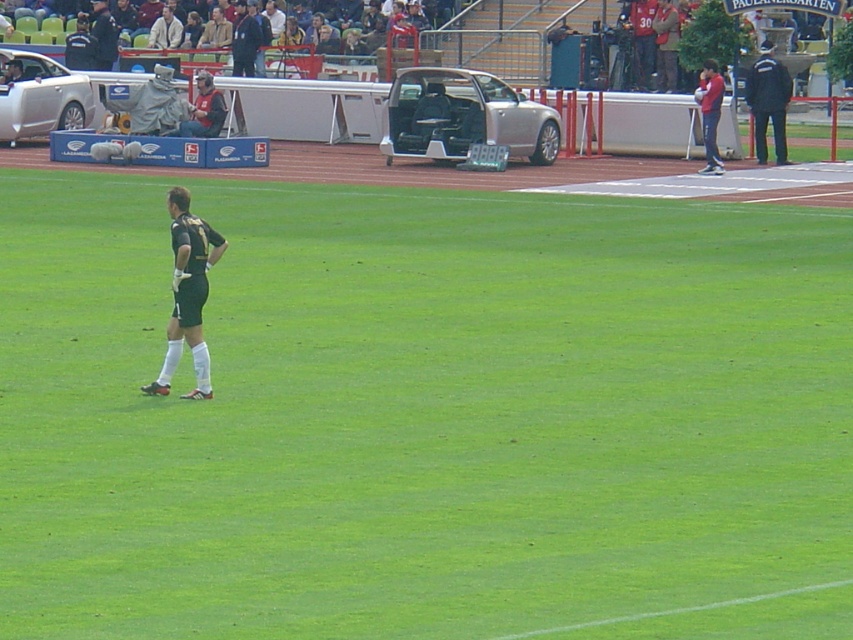
Question: Which object is closer to the camera taking this photo?

Choices:
 (A) black uniform at right
 (B) green jersey at left
 (C) silver metallic sedan at left

Answer: (A)

Question: Is black uniform at right wider than red cotton shirt at upper right?

Choices:
 (A) yes
 (B) no

Answer: (A)

Question: Which object is positioned farthest from the green grass field at center?

Choices:
 (A) satin silver car at center
 (B) dark green jersey at left

Answer: (A)

Question: Is silver metallic sedan at left above green jersey at left?

Choices:
 (A) no
 (B) yes

Answer: (A)

Question: Which object is closer to the camera taking this photo?

Choices:
 (A) red cotton shirt at upper right
 (B) green jersey at left
 (C) black uniform at right
 (D) silver metallic sedan at left

Answer: (A)

Question: Does red cotton shirt at upper right appear under green jersey at left?

Choices:
 (A) yes
 (B) no

Answer: (A)